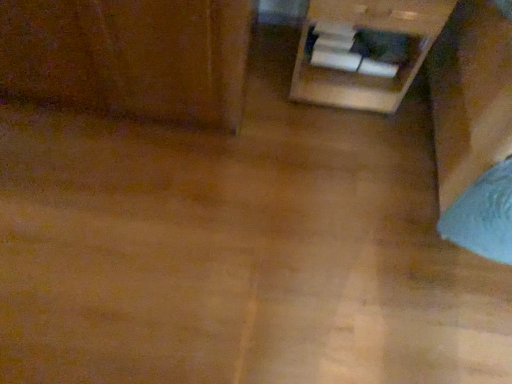
Where is `free space in front of wooden drawer at upper right`? This screenshot has width=512, height=384. free space in front of wooden drawer at upper right is located at coordinates (337, 157).